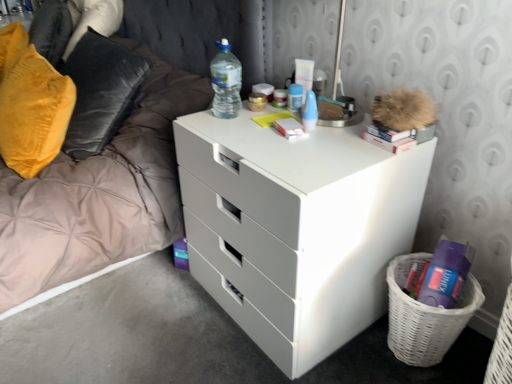
Measure the distance between point (221, 72) and camera.

The distance of point (221, 72) from camera is 1.27 meters.

The image size is (512, 384). I want to click on translucent plastic water bottle at upper center, so click(x=226, y=82).

What is the approximate height of white wicker basket at lower right?

The height of white wicker basket at lower right is 11.12 inches.

At what (x,y) coordinates should I click in order to perform the action: click on blue plastic spray can at upper center, the first toiletry from the front. Please return your answer as a coordinate pair (x, y). The image size is (512, 384). Looking at the image, I should click on (310, 112).

Describe the element at coordinates (295, 97) in the screenshot. I see `white plastic tube at upper center, positioned as the 1th toiletry in back-to-front order` at that location.

At what (x,y) coordinates should I click in order to perform the action: click on white matte chest of drawers at center. Please return your answer as a coordinate pair (x, y). This screenshot has width=512, height=384. Looking at the image, I should click on (296, 228).

Between translucent plastic water bottle at upper center and white plastic tube at upper center, positioned as the 1th toiletry in back-to-front order, which one appears on the left side from the viewer's perspective?

From the viewer's perspective, translucent plastic water bottle at upper center appears more on the left side.

Is translucent plastic water bottle at upper center facing away from white plastic tube at upper center, positioned as the 1th toiletry in back-to-front order?

translucent plastic water bottle at upper center does not have its back to white plastic tube at upper center, positioned as the 1th toiletry in back-to-front order.

From a real-world perspective, which is physically below, translucent plastic water bottle at upper center or white plastic tube at upper center, positioned as the 1th toiletry in back-to-front order?

From a 3D spatial view, white plastic tube at upper center, positioned as the 1th toiletry in back-to-front order, is below.

Is translucent plastic water bottle at upper center bigger or smaller than white plastic tube at upper center, positioned as the 1th toiletry in back-to-front order?

In the image, translucent plastic water bottle at upper center appears to be larger than white plastic tube at upper center, positioned as the 1th toiletry in back-to-front order.

Considering the positions of point (62, 270) and point (428, 136), is point (62, 270) closer or farther from the camera than point (428, 136)?

Point (62, 270).

Is white glossy bed frame at left wider or thinner than hardcover book at upper right, the 1th book positioned from the right?

white glossy bed frame at left is wider than hardcover book at upper right, the 1th book positioned from the right.

From a real-world perspective, which is physically above, white glossy bed frame at left or hardcover book at upper right, the 1th book positioned from the right?

hardcover book at upper right, the 1th book positioned from the right.

Considering the relative positions of white glossy bed frame at left and hardcover book at upper right, the 1th book positioned from the right, in the image provided, is white glossy bed frame at left to the left or to the right of hardcover book at upper right, the 1th book positioned from the right,?

From the image, it's evident that white glossy bed frame at left is to the left of hardcover book at upper right, the 1th book positioned from the right.

Could you tell me if blue plastic spray can at upper center, the first toiletry from the front, is facing white glossy bed frame at left?

No, blue plastic spray can at upper center, the first toiletry from the front, is not aimed at white glossy bed frame at left.

Based on the photo, from a real-world perspective, is blue plastic spray can at upper center, the 2th toiletry in the back-to-front sequence, physically above white glossy bed frame at left?

Indeed, from a real-world perspective, blue plastic spray can at upper center, the 2th toiletry in the back-to-front sequence, stands above white glossy bed frame at left.

Is blue plastic spray can at upper center, the first toiletry from the front, inside or outside of white glossy bed frame at left?

The correct answer is: outside.

From a real-world perspective, which is physically below, blue plastic spray can at upper center, the first toiletry from the front, or hardcover book at upper right, arranged as the second book when viewed from the left?

hardcover book at upper right, arranged as the second book when viewed from the left, is physically lower.

From the image's perspective, is blue plastic spray can at upper center, the first toiletry from the front, under hardcover book at upper right, arranged as the second book when viewed from the left?

No, from the image's perspective, blue plastic spray can at upper center, the first toiletry from the front, is not beneath hardcover book at upper right, arranged as the second book when viewed from the left.

In the image, is blue plastic spray can at upper center, the first toiletry from the front, positioned in front of or behind hardcover book at upper right, the 1th book positioned from the right?

Clearly, blue plastic spray can at upper center, the first toiletry from the front, is behind hardcover book at upper right, the 1th book positioned from the right.

Is blue plastic spray can at upper center, the 2th toiletry in the back-to-front sequence, looking in the opposite direction of hardcover book at upper right, arranged as the second book when viewed from the left?

blue plastic spray can at upper center, the 2th toiletry in the back-to-front sequence, is not turned away from hardcover book at upper right, arranged as the second book when viewed from the left.

Is white plastic tube at upper center, which is the 2th toiletry from front to back, bigger than translucent plastic water bottle at upper center?

Incorrect, white plastic tube at upper center, which is the 2th toiletry from front to back, is not larger than translucent plastic water bottle at upper center.

The image size is (512, 384). In order to click on the 2nd toiletry located beneath the translucent plastic water bottle at upper center (from a real-world perspective) in this screenshot , I will do `click(295, 97)`.

Are white plastic tube at upper center, positioned as the 1th toiletry in back-to-front order, and translucent plastic water bottle at upper center beside each other?

No, white plastic tube at upper center, positioned as the 1th toiletry in back-to-front order, is not in contact with translucent plastic water bottle at upper center.

From a real-world perspective, who is located lower, white plastic tube at upper center, positioned as the 1th toiletry in back-to-front order, or translucent plastic water bottle at upper center?

From a 3D spatial view, white plastic tube at upper center, positioned as the 1th toiletry in back-to-front order, is below.

Considering the relative sizes of blue plastic spray can at upper center, the first toiletry from the front, and white wicker basket at lower right in the image provided, is blue plastic spray can at upper center, the first toiletry from the front, bigger than white wicker basket at lower right?

No.

Which object is thinner, blue plastic spray can at upper center, the first toiletry from the front, or white wicker basket at lower right?

blue plastic spray can at upper center, the first toiletry from the front, is thinner.

From a real-world perspective, is blue plastic spray can at upper center, the first toiletry from the front, physically located above or below white wicker basket at lower right?

In terms of real-world spatial position, blue plastic spray can at upper center, the first toiletry from the front, is above white wicker basket at lower right.

Would you consider blue plastic spray can at upper center, the 2th toiletry in the back-to-front sequence, to be distant from white wicker basket at lower right?

No.

Is white plastic tube at upper center, positioned as the 1th toiletry in back-to-front order, not near white matte book at center, which ranks as the second book in right-to-left order?

white plastic tube at upper center, positioned as the 1th toiletry in back-to-front order, is near white matte book at center, which ranks as the second book in right-to-left order, not far away.

From a real-world perspective, which is physically above, white plastic tube at upper center, which is the 2th toiletry from front to back, or white matte book at center, which ranks as the 1th book in left-to-right order?

white plastic tube at upper center, which is the 2th toiletry from front to back, from a real-world perspective.

Locate an element on the screen. The image size is (512, 384). the 2nd toiletry behind when counting from the white matte book at center, which ranks as the 1th book in left-to-right order is located at coordinates (295, 97).

Find the location of `toiletry that is the 2nd object directly below the translucent plastic water bottle at upper center (from a real-world perspective)`. toiletry that is the 2nd object directly below the translucent plastic water bottle at upper center (from a real-world perspective) is located at coordinates (295, 97).

You are a GUI agent. You are given a task and a screenshot of the screen. Output one action in this format:
    pyautogui.click(x=<x>, y=<y>)
    Task: Click on the 1st book behind the white glossy bed frame at left
    The height and width of the screenshot is (384, 512).
    Given the screenshot: What is the action you would take?
    pyautogui.click(x=398, y=138)

From the picture: When comparing their distances from white glossy bed frame at left, does white plastic tube at upper center, positioned as the 1th toiletry in back-to-front order, or blue plastic spray can at upper center, the 2th toiletry in the back-to-front sequence, seem closer?

Based on the image, white plastic tube at upper center, positioned as the 1th toiletry in back-to-front order, appears to be nearer to white glossy bed frame at left.

Which object lies further to the anchor point translucent plastic water bottle at upper center, white wicker basket at lower right or white matte book at center, which ranks as the second book in right-to-left order?

white wicker basket at lower right is positioned further to the anchor translucent plastic water bottle at upper center.

Looking at the image, which one is located closer to white matte chest of drawers at center, white glossy bed frame at left or hardcover book at upper right, arranged as the second book when viewed from the left?

hardcover book at upper right, arranged as the second book when viewed from the left, is closer to white matte chest of drawers at center.

Estimate the real-world distances between objects in this image. Which object is further from white plastic tube at upper center, positioned as the 1th toiletry in back-to-front order, white glossy bed frame at left or white matte chest of drawers at center?

white glossy bed frame at left.

Looking at this image, which object lies nearer to the anchor point white matte book at center, which ranks as the 1th book in left-to-right order, white wicker basket at lower right or hardcover book at upper right, the 1th book positioned from the right?

Among the two, hardcover book at upper right, the 1th book positioned from the right, is located nearer to white matte book at center, which ranks as the 1th book in left-to-right order.

Estimate the real-world distances between objects in this image. Which object is closer to white matte chest of drawers at center, blue plastic spray can at upper center, the 2th toiletry in the back-to-front sequence, or white matte book at center, which ranks as the second book in right-to-left order?

white matte book at center, which ranks as the second book in right-to-left order, lies closer to white matte chest of drawers at center than the other object.

Estimate the real-world distances between objects in this image. Which object is closer to white wicker basket at lower right, white glossy bed frame at left or velvet yellow pillow at left?

Based on the image, white glossy bed frame at left appears to be nearer to white wicker basket at lower right.

Based on their spatial positions, is velvet yellow pillow at left or blue plastic spray can at upper center, the first toiletry from the front, further from white wicker basket at lower right?

Based on the image, velvet yellow pillow at left appears to be further to white wicker basket at lower right.

At what (x,y) coordinates should I click in order to perform the action: click on book between translucent plastic water bottle at upper center and blue plastic spray can at upper center, the 2th toiletry in the back-to-front sequence, from left to right. Please return your answer as a coordinate pair (x, y). Looking at the image, I should click on (290, 128).

Where is `pillow situated between white glossy bed frame at left and white wicker basket at lower right from left to right`? The width and height of the screenshot is (512, 384). pillow situated between white glossy bed frame at left and white wicker basket at lower right from left to right is located at coordinates (34, 113).

Locate an element on the screen. toiletry between white plastic tube at upper center, which is the 2th toiletry from front to back, and hardcover book at upper right, the 1th book positioned from the right, in the horizontal direction is located at coordinates (310, 112).

Locate an element on the screen. book located between velvet yellow pillow at left and white matte chest of drawers at center in the left-right direction is located at coordinates (290, 128).